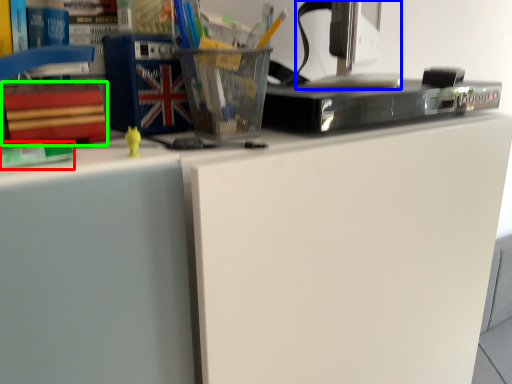
Question: Which is farther away from book (highlighted by a red box)? desktop computer (highlighted by a blue box) or paperback book (highlighted by a green box)?

Choices:
 (A) desktop computer
 (B) paperback book

Answer: (A)